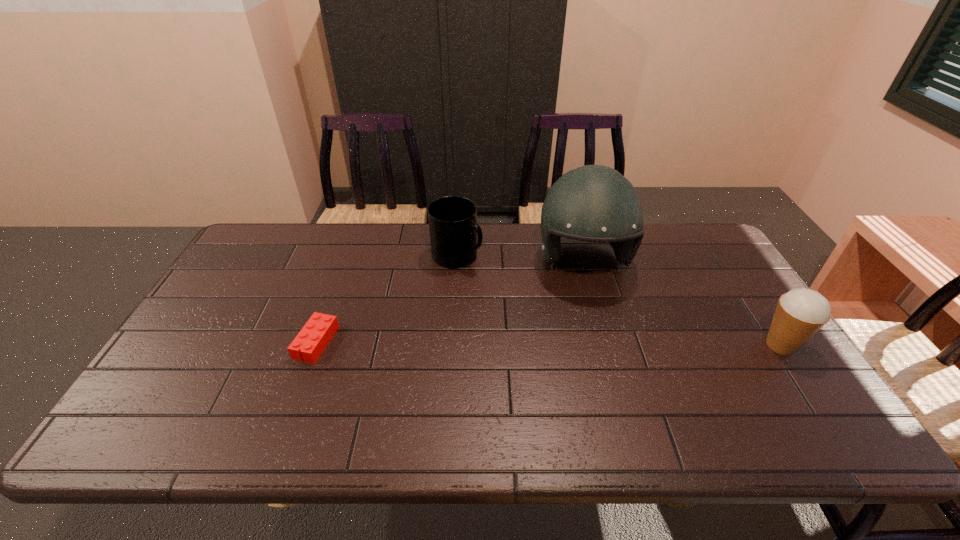
At what (x,y) coordinates should I click in order to perform the action: click on vacant spot on the desktop that is between the shortest object and the icecream and is positioned at the face opening of the second object from right to left. Please return your answer as a coordinate pair (x, y). Image resolution: width=960 pixels, height=540 pixels. Looking at the image, I should click on (603, 344).

This screenshot has height=540, width=960. In order to click on free spot on the desktop that is between the shortest object and the rightmost object and is positioned on the side of the second object from left to right with the handle in this screenshot , I will do `click(599, 344)`.